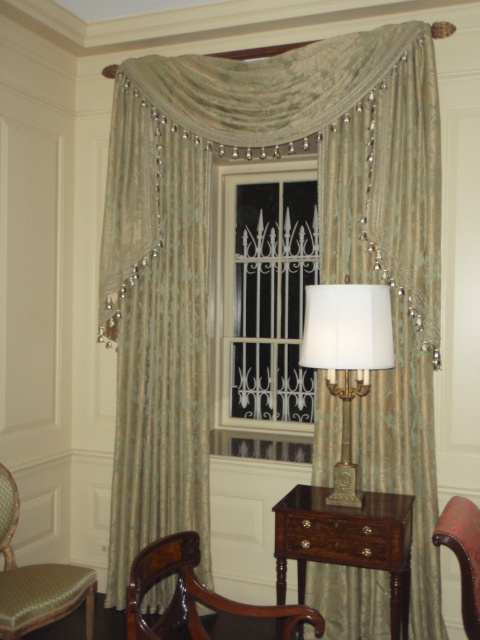
Does white fabric lampshade at center have a larger size compared to mahogany wood armchair at lower left?

Yes, white fabric lampshade at center is bigger than mahogany wood armchair at lower left.

Can you confirm if white fabric lampshade at center is smaller than mahogany wood armchair at lower left?

No, white fabric lampshade at center is not smaller than mahogany wood armchair at lower left.

Identify the location of white fabric lampshade at center. The image size is (480, 640). (347, 356).

Does mahogany drawer at center have a larger size compared to white fabric lampshade at center?

Yes, mahogany drawer at center is bigger than white fabric lampshade at center.

Between mahogany drawer at center and white fabric lampshade at center, which one appears on the left side from the viewer's perspective?

Positioned to the left is white fabric lampshade at center.

Which is behind, point (320, 544) or point (349, 477)?

The point (349, 477) is more distant.

You are a GUI agent. You are given a task and a screenshot of the screen. Output one action in this format:
    pyautogui.click(x=<x>, y=<y>)
    Task: Click on the mahogany drawer at center
    
    Given the screenshot: What is the action you would take?
    pyautogui.click(x=347, y=540)

Is green textured curtains at center further to camera compared to mahogany drawer at center?

That is True.

Identify the location of green textured curtains at center. The width and height of the screenshot is (480, 640). (321, 266).